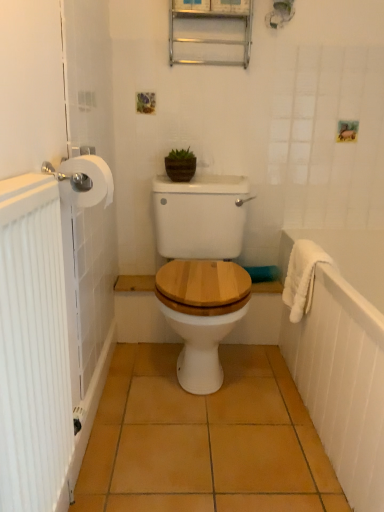
Question: Is white ribbed radiator at left wider than white fluffy bath towel at right?

Choices:
 (A) yes
 (B) no

Answer: (B)

Question: Is white ribbed radiator at left oriented towards white fluffy bath towel at right?

Choices:
 (A) yes
 (B) no

Answer: (B)

Question: Is white fluffy bath towel at right at the back of white ribbed radiator at left?

Choices:
 (A) no
 (B) yes

Answer: (A)

Question: Could white fluffy bath towel at right be considered to be inside white ribbed radiator at left?

Choices:
 (A) no
 (B) yes

Answer: (A)

Question: Considering the relative positions of white ribbed radiator at left and white fluffy bath towel at right in the image provided, is white ribbed radiator at left in front of white fluffy bath towel at right?

Choices:
 (A) yes
 (B) no

Answer: (A)

Question: Is white ribbed radiator at left outside white fluffy bath towel at right?

Choices:
 (A) no
 (B) yes

Answer: (B)

Question: From the image's perspective, is metallic silver medicine cabinet at upper center above white textured towel at right?

Choices:
 (A) yes
 (B) no

Answer: (A)

Question: Is metallic silver medicine cabinet at upper center in front of white textured towel at right?

Choices:
 (A) no
 (B) yes

Answer: (A)

Question: Does metallic silver medicine cabinet at upper center have a greater height compared to white textured towel at right?

Choices:
 (A) no
 (B) yes

Answer: (A)

Question: Can we say metallic silver medicine cabinet at upper center lies outside white textured towel at right?

Choices:
 (A) yes
 (B) no

Answer: (A)

Question: Considering the relative sizes of metallic silver medicine cabinet at upper center and white textured towel at right in the image provided, is metallic silver medicine cabinet at upper center bigger than white textured towel at right?

Choices:
 (A) no
 (B) yes

Answer: (A)

Question: From a real-world perspective, does metallic silver medicine cabinet at upper center stand above white textured towel at right?

Choices:
 (A) no
 (B) yes

Answer: (B)

Question: Are white ribbed radiator at left and metallic silver medicine cabinet at upper center beside each other?

Choices:
 (A) no
 (B) yes

Answer: (A)